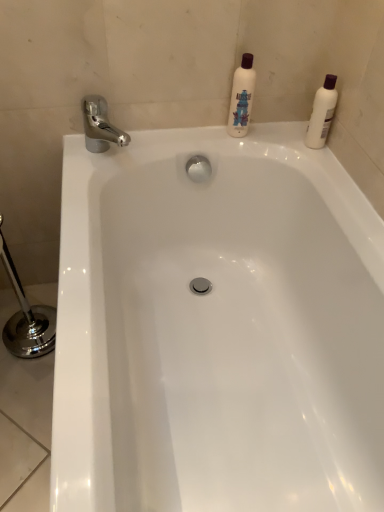
Question: Is white glossy bathtub at center in front of or behind white matte bottle at upper center, which is the 1th cleaning product in left-to-right order, in the image?

Choices:
 (A) behind
 (B) front

Answer: (B)

Question: Looking at the image, does white glossy bathtub at center seem bigger or smaller compared to white matte bottle at upper center, which is the 1th cleaning product in left-to-right order?

Choices:
 (A) big
 (B) small

Answer: (A)

Question: Which is nearer to the white matte bottle at upper center, which is the 1th cleaning product in left-to-right order?

Choices:
 (A) chrome metallic faucet at upper left
 (B) white glossy bathtub at center
 (C) white plastic bottle at upper right, positioned as the 1th cleaning product in right-to-left order

Answer: (C)

Question: Estimate the real-world distances between objects in this image. Which object is farther from the chrome metallic faucet at upper left?

Choices:
 (A) white matte bottle at upper center, which is the 1th cleaning product in left-to-right order
 (B) white glossy bathtub at center
 (C) white plastic bottle at upper right, positioned as the 1th cleaning product in right-to-left order

Answer: (C)